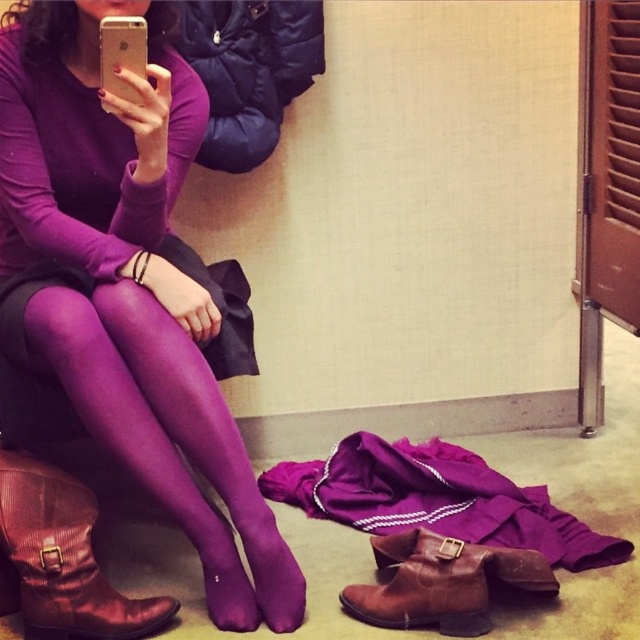
You are a stylist helping someone take a selfie in a dressing room. They are wearing matte purple tights at lower center and have brown suede boot at lower center nearby. To ensure the boots are visible in the photo, should they move the boots closer to or farther from the camera?

The matte purple tights at lower center is located above the brown suede boot at lower center, so to make the boots more visible in the photo, they should move the boots closer to the camera to avoid being obscured by the tights.